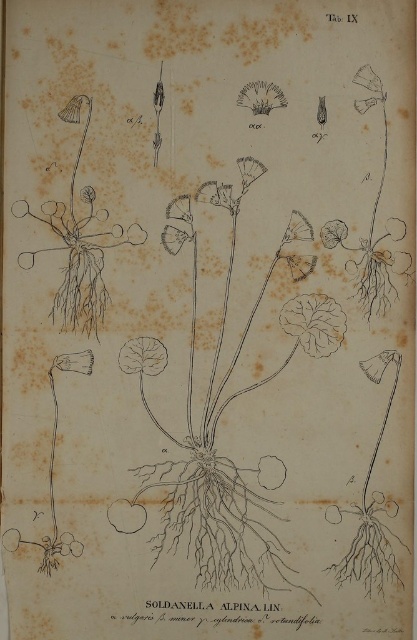
Question: Which is farther from the brown textured flower at upper center?

Choices:
 (A) green leafy at center
 (B) green leafy plant at center

Answer: (A)

Question: Which point appears closest to the camera in this image?

Choices:
 (A) (236, 104)
 (B) (333, 321)

Answer: (A)

Question: Can you confirm if green leafy plant at center is thinner than green leafy at center?

Choices:
 (A) no
 (B) yes

Answer: (A)

Question: From the image, what is the correct spatial relationship of green leafy at center in relation to brown textured flower at upper center?

Choices:
 (A) below
 (B) above

Answer: (A)

Question: Which is farther from the green leafy plant at center?

Choices:
 (A) green leafy at center
 (B) brown textured flower at upper center

Answer: (B)

Question: In this image, where is green leafy at center located relative to brown textured flower at upper center?

Choices:
 (A) below
 (B) above

Answer: (A)